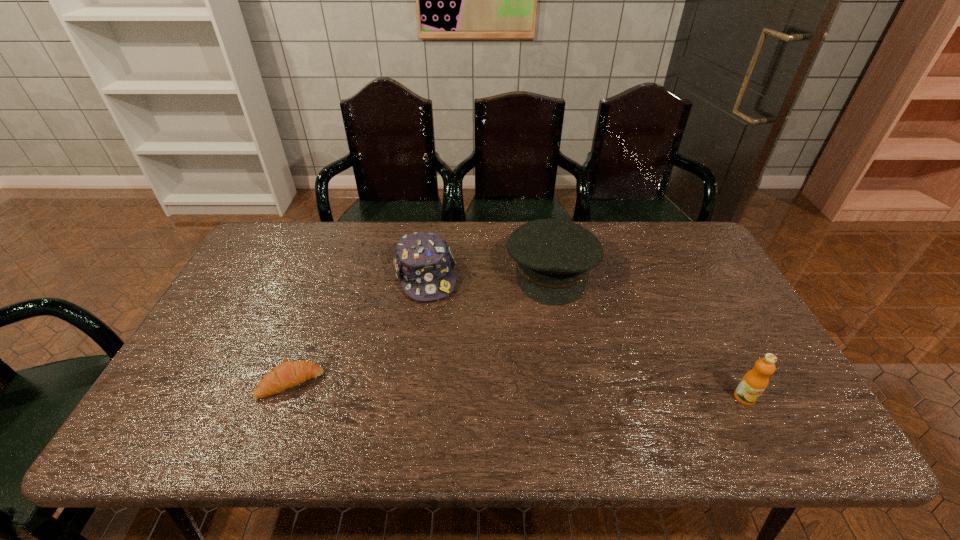
Locate an element on the screen. This screenshot has height=540, width=960. crescent roll is located at coordinates (288, 374).

The width and height of the screenshot is (960, 540). I want to click on the shortest object, so click(288, 374).

This screenshot has width=960, height=540. Identify the location of orange juice. (755, 381).

I want to click on beret, so click(553, 257).

Find the location of a particular element. Image resolution: width=960 pixels, height=540 pixels. the second object from left to right is located at coordinates (424, 264).

Find the location of a particular element. The image size is (960, 540). headwear is located at coordinates (424, 264).

Where is `free space located on the right of the leftmost object`? The height and width of the screenshot is (540, 960). free space located on the right of the leftmost object is located at coordinates (456, 383).

Identify the location of vacant region located on the front-facing side of the beret. The height and width of the screenshot is (540, 960). (554, 346).

Find the location of `vacant space located 0.140m on the front-facing side of the beret`. vacant space located 0.140m on the front-facing side of the beret is located at coordinates (554, 343).

You are a GUI agent. You are given a task and a screenshot of the screen. Output one action in this format:
    pyautogui.click(x=<x>, y=<y>)
    Task: Click on the vacant space located 0.220m on the front-facing side of the beret
    The width and height of the screenshot is (960, 540).
    Given the screenshot: What is the action you would take?
    pyautogui.click(x=554, y=367)